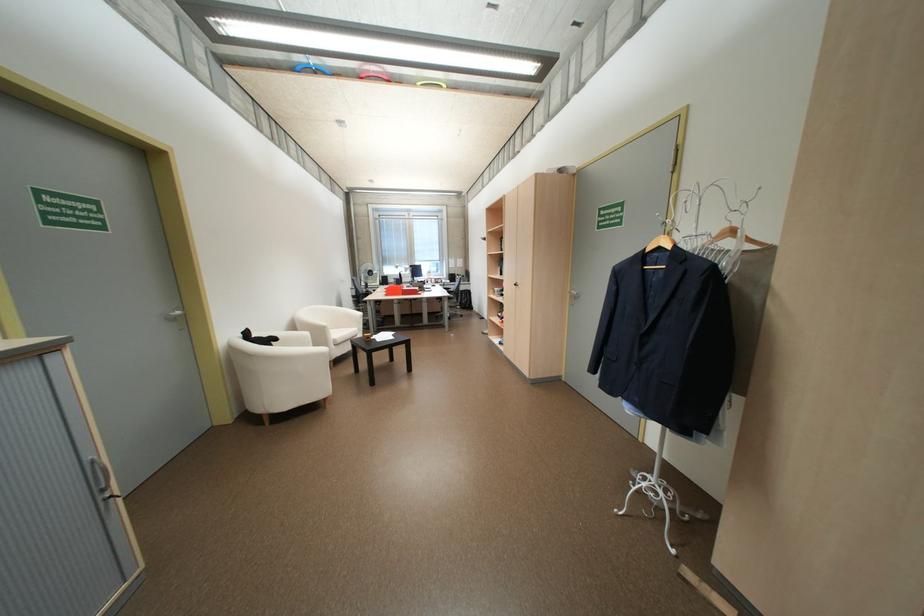
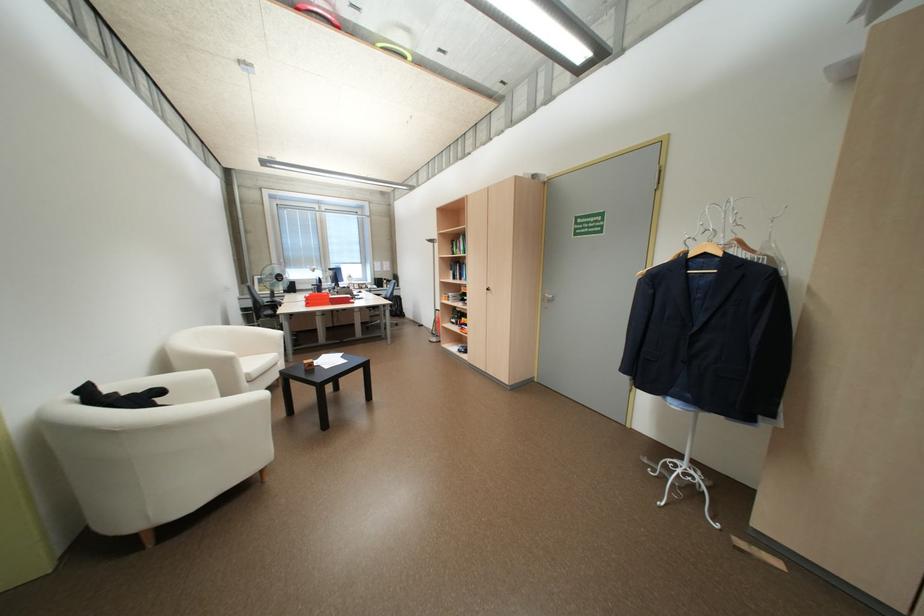
Question: The images are taken continuously from a first-person perspective. In which direction is your viewpoint rotating?

Choices:
 (A) Left
 (B) Right
 (C) Up
 (D) Down

Answer: (B)